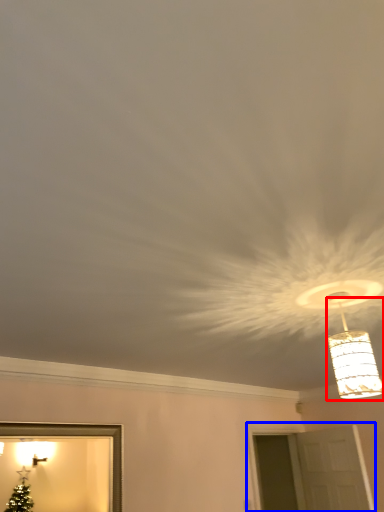
Question: Which point is closer to the camera, lamp (highlighted by a red box) or window (highlighted by a blue box)?

Choices:
 (A) lamp
 (B) window

Answer: (A)